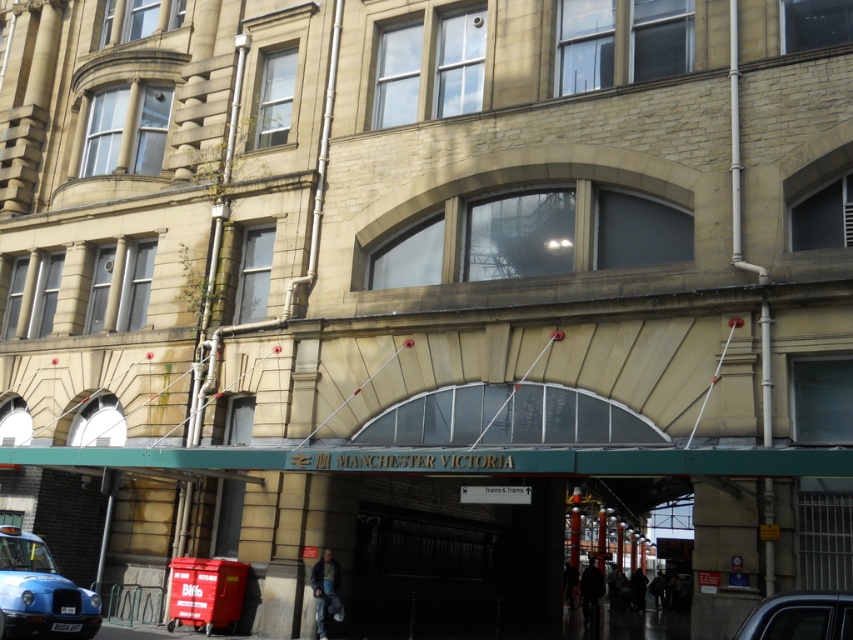
You are standing at the entrance of Manchester Victoria railway station and see two points marked on the ground. The first point is at coordinates point (50, 627) and the second point is at point (839, 596). Which point is closer to you as you face the station entrance?

Point (50, 627) is behind point (839, 596), so the point closer to you would be point (839, 596) since it is in front.